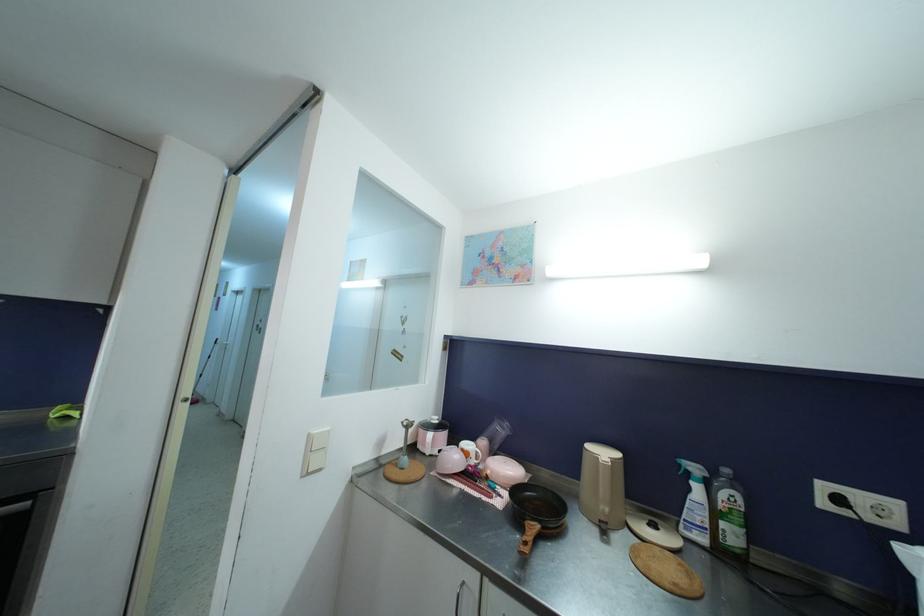
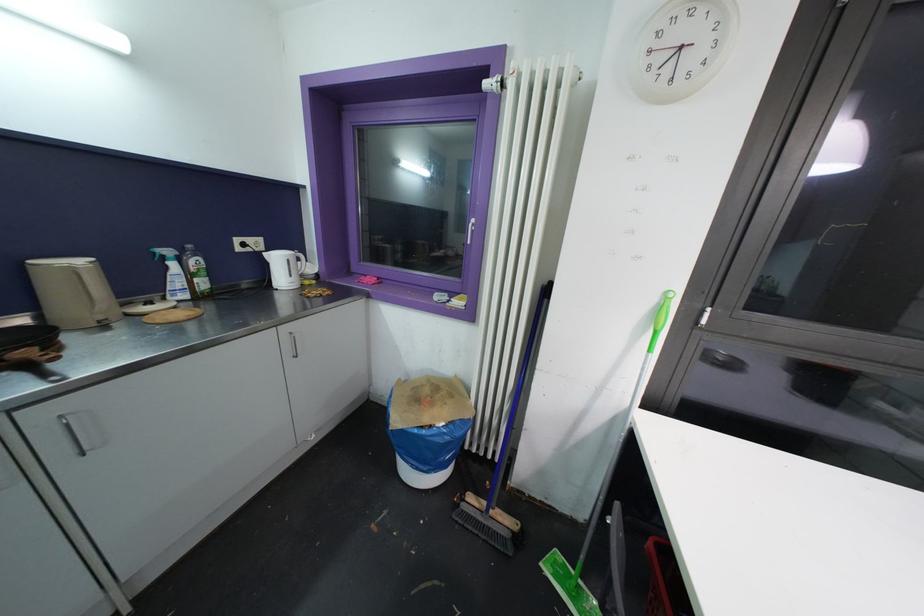
Locate, in the second image, the point that corresponds to the point at 699,472 in the first image.

(171, 254)